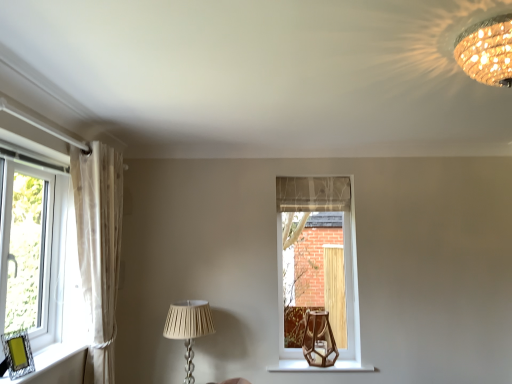
Question: Relative to sheer white curtain at left, is clear glass window at center, marked as the 1th window in a right-to-left arrangement, in front or behind?

Choices:
 (A) behind
 (B) front

Answer: (A)

Question: From the image's perspective, is clear glass window at center, the first window when ordered from back to front, located above or below sheer white curtain at left?

Choices:
 (A) above
 (B) below

Answer: (B)

Question: Considering the real-world distances, which object is farthest from the white pleated fabric lampshade at lower center, arranged as the 2th lamp when viewed from the top?

Choices:
 (A) wooden hexagonal vase at lower center
 (B) gold textured chandelier at upper right, positioned as the first lamp in right-to-left order
 (C) clear glass window at left, which is the second window in back-to-front order
 (D) clear glass window at center, arranged as the 2th window when viewed from the left
 (E) sheer white curtain at left

Answer: (B)

Question: Based on their relative distances, which object is nearer to the clear glass window at left, the 1th window from the front?

Choices:
 (A) gold textured chandelier at upper right, acting as the 1th lamp starting from the top
 (B) brown glass table lamp at center
 (C) sheer white curtain at left
 (D) clear glass window at center, arranged as the 2th window when viewed from the left
 (E) wooden hexagonal vase at lower center

Answer: (C)